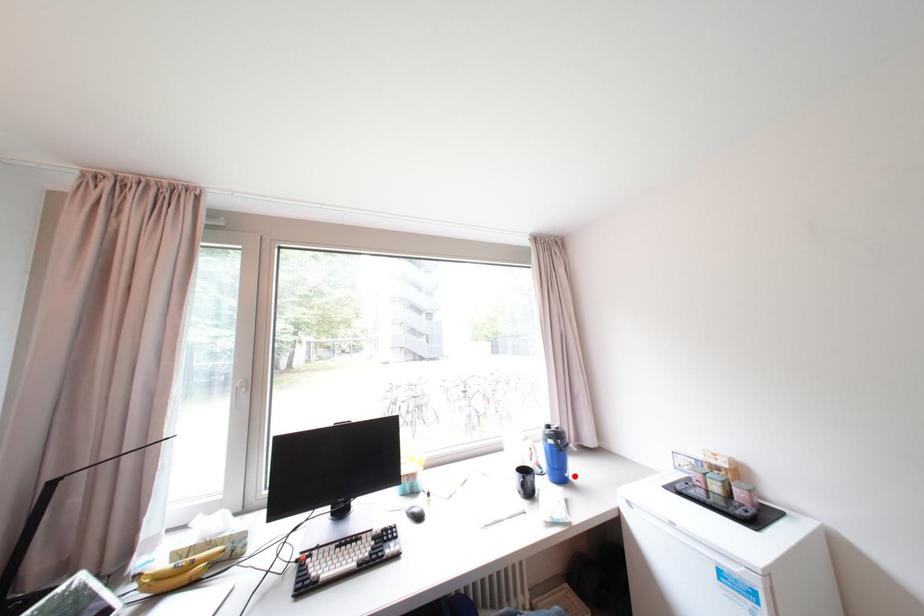
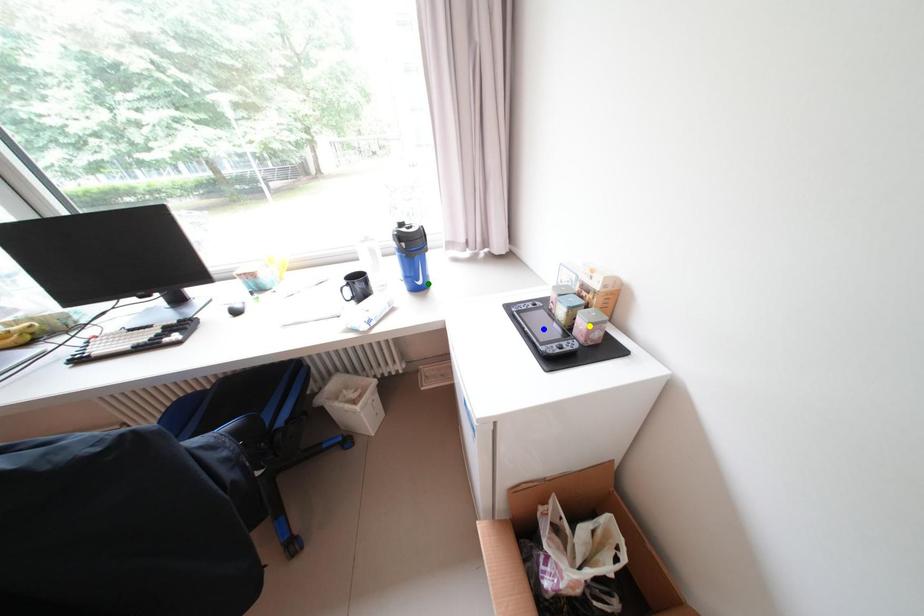
Question: I am providing you with two images of the same scene from different viewpoints. A red point is marked on the first image. You are given multiple points on the second image. Which point in image 2 represents the same 3d spot as the red point in image 1?

Choices:
 (A) yellow point
 (B) blue point
 (C) green point

Answer: (C)